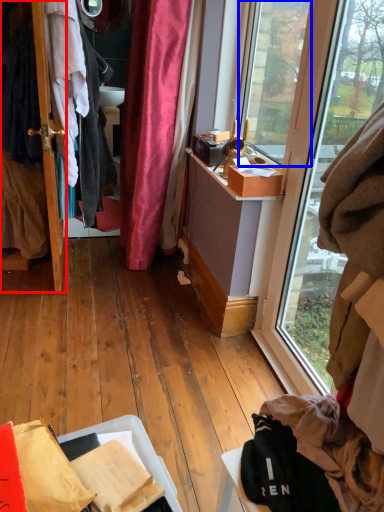
Question: Among these objects, which one is farthest to the camera, door (highlighted by a red box) or window screen (highlighted by a blue box)?

Choices:
 (A) door
 (B) window screen

Answer: (A)